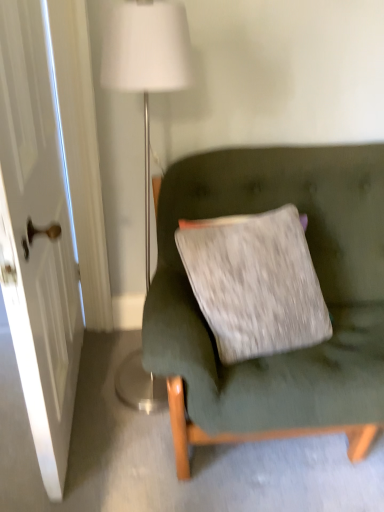
Question: Is velvet green couch at center bigger or smaller than white glossy door at left?

Choices:
 (A) small
 (B) big

Answer: (A)

Question: Is velvet green couch at center situated inside white glossy door at left or outside?

Choices:
 (A) outside
 (B) inside

Answer: (A)

Question: Estimate the real-world distances between objects in this image. Which object is farther from the white glossy door at left?

Choices:
 (A) white fabric lampshade at upper center
 (B) velvet green couch at center

Answer: (B)

Question: Based on their relative distances, which object is farther from the white fabric lampshade at upper center?

Choices:
 (A) white glossy door at left
 (B) velvet green couch at center

Answer: (B)